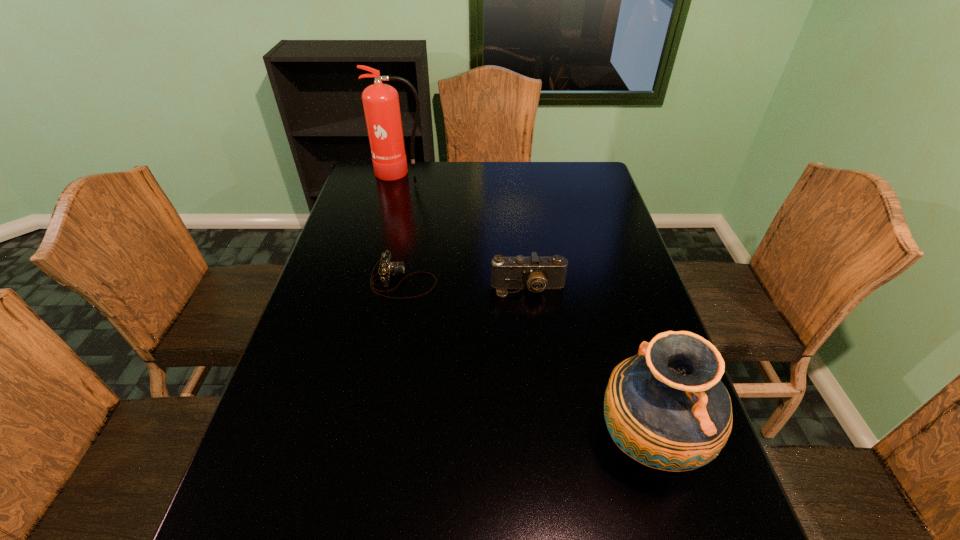
You are a GUI agent. You are given a task and a screenshot of the screen. Output one action in this format:
    pyautogui.click(x=<x>, y=<y>)
    Task: Click on the vacant area between the nearest object and the third tallest object
    The image size is (960, 540).
    Given the screenshot: What is the action you would take?
    pyautogui.click(x=588, y=364)

The image size is (960, 540). What are the coordinates of `empty space that is in between the pottery and the taller camera` in the screenshot? It's located at (588, 364).

Identify the location of free space between the taller camera and the pottery. This screenshot has width=960, height=540. click(588, 364).

Where is `vacant area between the nearest object and the right camera`? Image resolution: width=960 pixels, height=540 pixels. vacant area between the nearest object and the right camera is located at coordinates (588, 364).

Locate an element on the screen. This screenshot has height=540, width=960. free space between the farthest object and the third shortest object is located at coordinates (524, 307).

Image resolution: width=960 pixels, height=540 pixels. I want to click on free space between the shortest object and the right camera, so click(466, 285).

Locate an element on the screen. free space between the shorter camera and the second tallest object is located at coordinates (525, 361).

Image resolution: width=960 pixels, height=540 pixels. I want to click on empty space that is in between the pottery and the taller camera, so click(x=588, y=364).

You are a GUI agent. You are given a task and a screenshot of the screen. Output one action in this format:
    pyautogui.click(x=<x>, y=<y>)
    Task: Click on the free space between the left camera and the second tallest object
    
    Given the screenshot: What is the action you would take?
    pyautogui.click(x=525, y=361)

The image size is (960, 540). I want to click on free spot between the right camera and the shorter camera, so click(x=466, y=285).